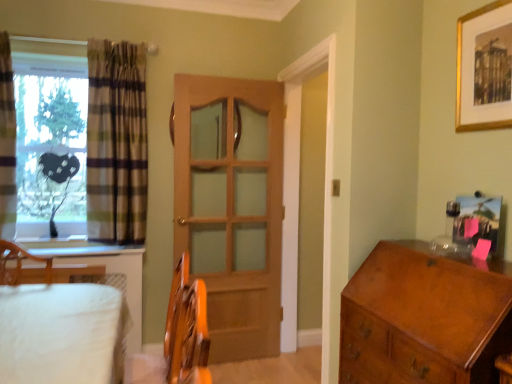
Question: Could you tell me if plaid fabric curtain at left, the 1th curtain when ordered from left to right, is turned towards transparent plastic heart at left?

Choices:
 (A) no
 (B) yes

Answer: (A)

Question: Does plaid fabric curtain at left, positioned as the second curtain in right-to-left order, have a greater width compared to transparent plastic heart at left?

Choices:
 (A) no
 (B) yes

Answer: (A)

Question: Can you confirm if plaid fabric curtain at left, the 1th curtain when ordered from left to right, is smaller than transparent plastic heart at left?

Choices:
 (A) yes
 (B) no

Answer: (A)

Question: Is plaid fabric curtain at left, positioned as the second curtain in right-to-left order, thinner than transparent plastic heart at left?

Choices:
 (A) yes
 (B) no

Answer: (A)

Question: Does plaid fabric curtain at left, positioned as the second curtain in right-to-left order, have a larger size compared to transparent plastic heart at left?

Choices:
 (A) yes
 (B) no

Answer: (B)

Question: Is shiny brown wooden chest of drawers at right in front of or behind transparent plastic heart at left in the image?

Choices:
 (A) front
 (B) behind

Answer: (A)

Question: Does point (450, 274) appear closer or farther from the camera than point (69, 177)?

Choices:
 (A) closer
 (B) farther

Answer: (A)

Question: From their relative heights in the image, would you say shiny brown wooden chest of drawers at right is taller or shorter than transparent plastic heart at left?

Choices:
 (A) short
 (B) tall

Answer: (A)

Question: From the image's perspective, is shiny brown wooden chest of drawers at right above or below transparent plastic heart at left?

Choices:
 (A) below
 (B) above

Answer: (A)

Question: Would you say transparent plastic heart at left is to the left or to the right of wooden door at center in the picture?

Choices:
 (A) left
 (B) right

Answer: (A)

Question: Relative to wooden door at center, is transparent plastic heart at left in front or behind?

Choices:
 (A) front
 (B) behind

Answer: (A)

Question: In terms of height, does transparent plastic heart at left look taller or shorter compared to wooden door at center?

Choices:
 (A) short
 (B) tall

Answer: (A)

Question: Is transparent plastic heart at left spatially inside wooden door at center, or outside of it?

Choices:
 (A) outside
 (B) inside

Answer: (A)

Question: Is point (0, 226) closer or farther from the camera than point (473, 198)?

Choices:
 (A) closer
 (B) farther

Answer: (B)

Question: Is plaid fabric curtain at left, the 1th curtain when ordered from left to right, in front of or behind metallic gold picture frame at upper right, which ranks as the first picture frame in bottom-to-top order, in the image?

Choices:
 (A) front
 (B) behind

Answer: (B)